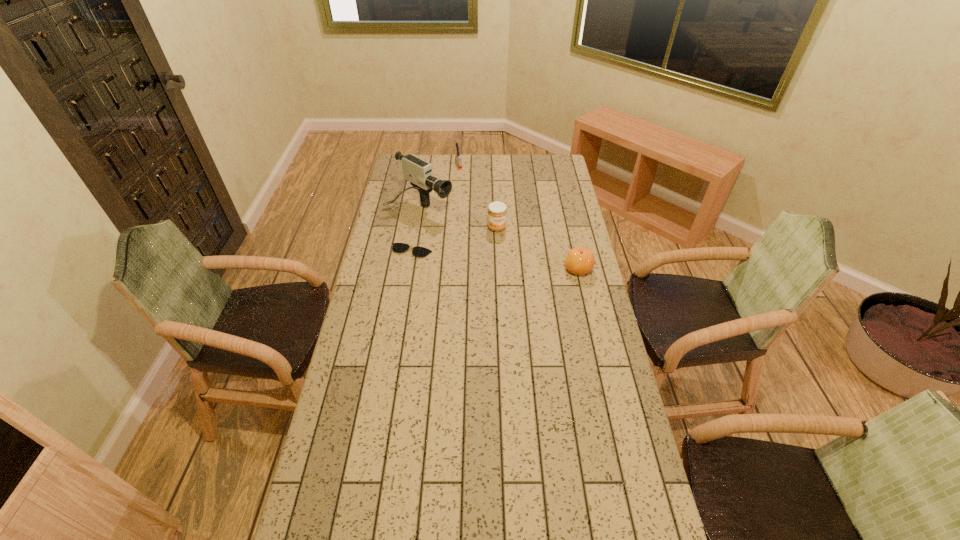
You are a GUI agent. You are given a task and a screenshot of the screen. Output one action in this format:
    pyautogui.click(x=<x>, y=<y>)
    Task: Click on the spectacles that is at the left edge
    This screenshot has width=960, height=540.
    Given the screenshot: What is the action you would take?
    pyautogui.click(x=418, y=251)

What are the coordinates of `camcorder located in the left edge section of the desktop` in the screenshot? It's located at (419, 172).

Locate an element on the screen. This screenshot has width=960, height=540. object that is at the right edge is located at coordinates (579, 260).

The height and width of the screenshot is (540, 960). I want to click on vacant space at the near edge of the desktop, so click(457, 534).

This screenshot has height=540, width=960. Find the location of `vacant space at the left edge`. vacant space at the left edge is located at coordinates (388, 356).

I want to click on vacant region at the right edge of the desktop, so click(557, 179).

Where is `free space between the stapler and the shortest object`? free space between the stapler and the shortest object is located at coordinates (435, 207).

The image size is (960, 540). Identify the location of unoccupied area between the fourth farthest object and the nearest object. (494, 260).

I want to click on vacant area that lies between the camcorder and the jam, so click(459, 218).

Locate an element on the screen. The height and width of the screenshot is (540, 960). empty space between the second object from right to left and the clementine is located at coordinates (538, 248).